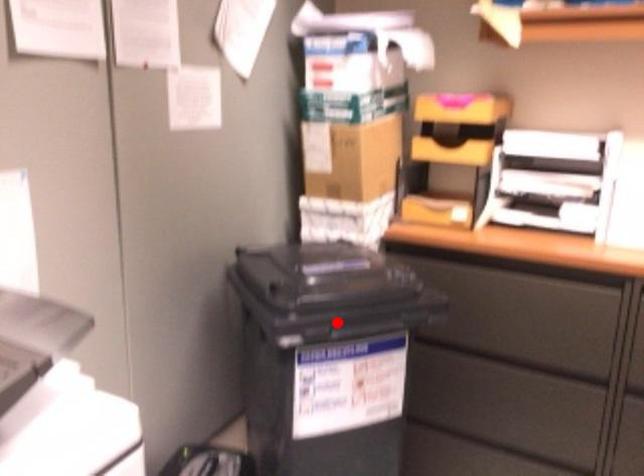
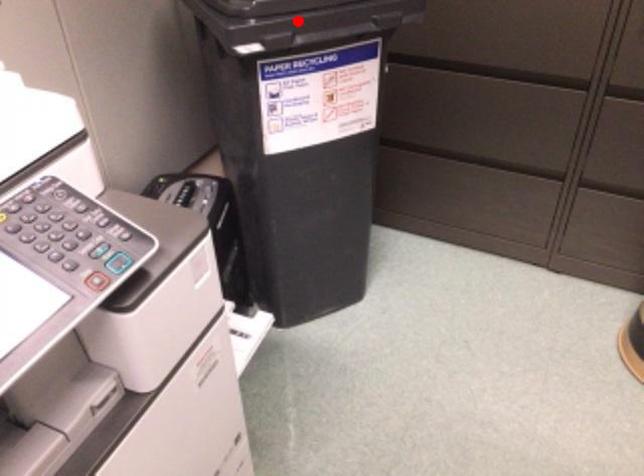
I am providing you with two images of the same scene from different viewpoints. A red point is marked on the first image and another point is marked on the second image. Do the highlighted points in image1 and image2 indicate the same real-world spot?

Yes